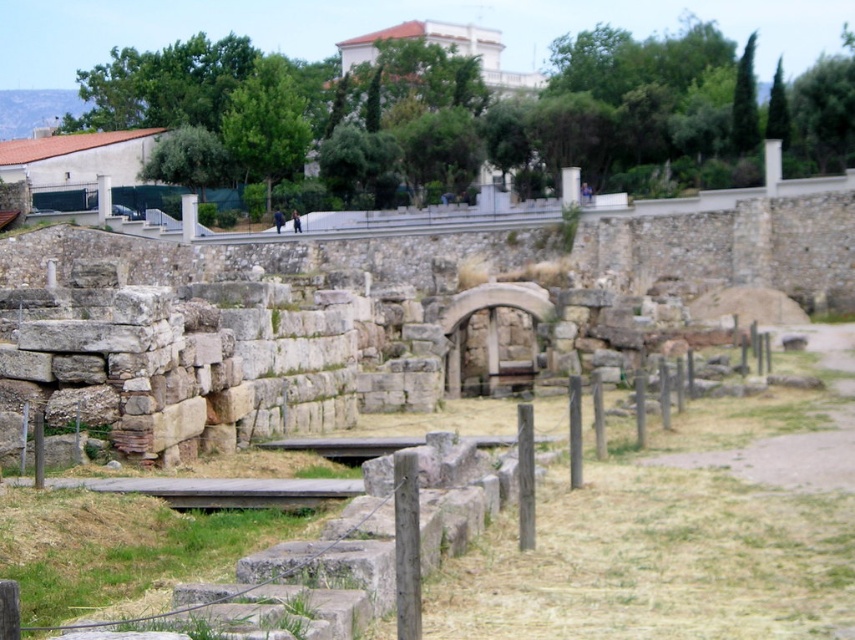
You are standing at the archaeological site and want to take a photo of the central archway. There is a point at coordinates point (187, 230) that is 181.54 meters away from you. Can you estimate how far this point is from the central archway?

The point at point (187, 230) is 181.54 meters away from the viewer, so it is approximately 181.54 meters away from the central archway.

You are a tour guide leading visitors through the archaeological site. You want to point out the pillars to your group. Which pillar is wider between the white stone pillar at center and the smooth stone pillar at center?

The white stone pillar at center is wider than the smooth stone pillar at center.

You are a tour guide leading a group at the archaeological site. You want to ensure visitors can see the white stone pillar at center from the wooden walkway. Is the pillar within the viewing range of the walkway?

The white stone pillar at center is 180.33 meters away from the camera, so it is likely within viewing range from the wooden walkway as long as there are no obstructions.